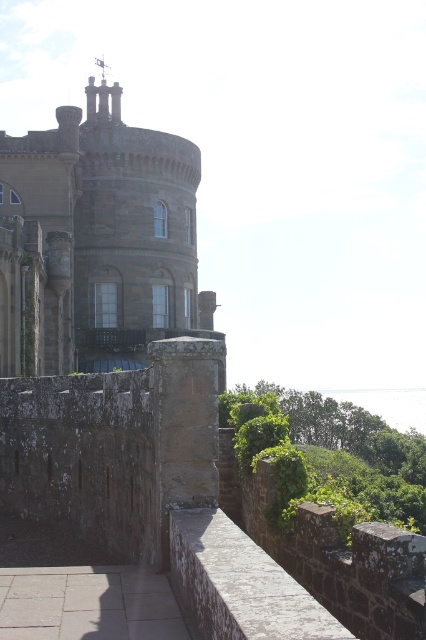
Question: Considering the relative positions of stone tower at center and stone wall at center in the image provided, where is stone tower at center located with respect to stone wall at center?

Choices:
 (A) above
 (B) below

Answer: (A)

Question: Can you confirm if stone tower at center is thinner than stone wall at center?

Choices:
 (A) yes
 (B) no

Answer: (B)

Question: Which point appears farthest from the camera in this image?

Choices:
 (A) (109, 310)
 (B) (224, 576)

Answer: (A)

Question: Is stone tower at center bigger than stone wall at center?

Choices:
 (A) yes
 (B) no

Answer: (A)

Question: Which point is farther to the camera?

Choices:
 (A) (301, 621)
 (B) (91, 442)

Answer: (B)